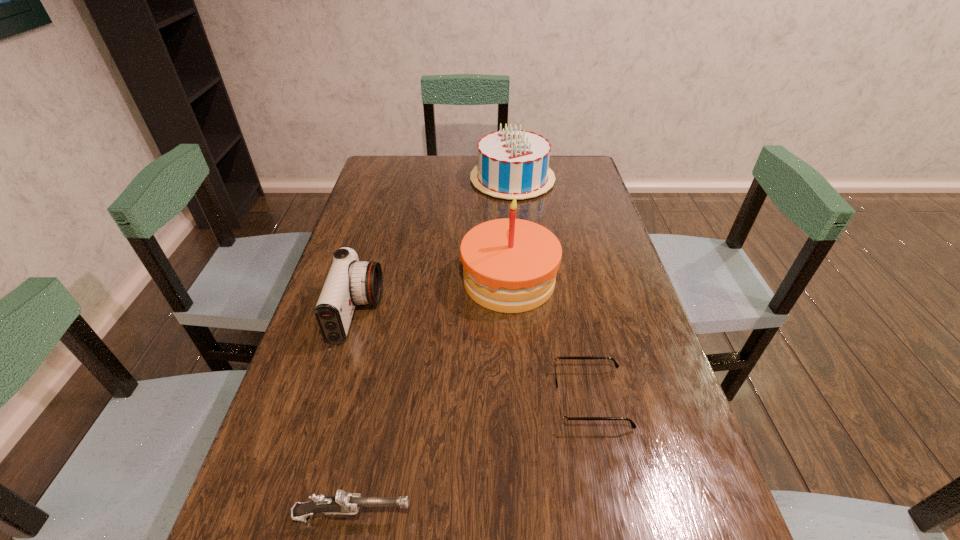
At what (x,y) coordinates should I click in order to perform the action: click on the taller birthday cake. Please return your answer as a coordinate pair (x, y). Looking at the image, I should click on (510, 265).

Where is `the nearer birthday cake`? The image size is (960, 540). the nearer birthday cake is located at coordinates (510, 265).

Find the location of a particular element. the farthest object is located at coordinates click(513, 163).

Locate an element on the screen. the fourth shortest object is located at coordinates (513, 163).

Locate an element on the screen. The width and height of the screenshot is (960, 540). camcorder is located at coordinates (350, 282).

You are a GUI agent. You are given a task and a screenshot of the screen. Output one action in this format:
    pyautogui.click(x=<x>, y=<y>)
    Task: Click on the fourth tallest object
    
    Given the screenshot: What is the action you would take?
    pyautogui.click(x=342, y=503)

At what (x,y) coordinates should I click in order to perform the action: click on gun. Please return your answer as a coordinate pair (x, y). This screenshot has width=960, height=540. Looking at the image, I should click on (342, 503).

At what (x,y) coordinates should I click in order to perform the action: click on the second nearest object. Please return your answer as a coordinate pair (x, y). The height and width of the screenshot is (540, 960). Looking at the image, I should click on (564, 418).

I want to click on spectacles, so click(x=564, y=418).

I want to click on vacant space located 0.320m on the back of the taller birthday cake, so click(503, 193).